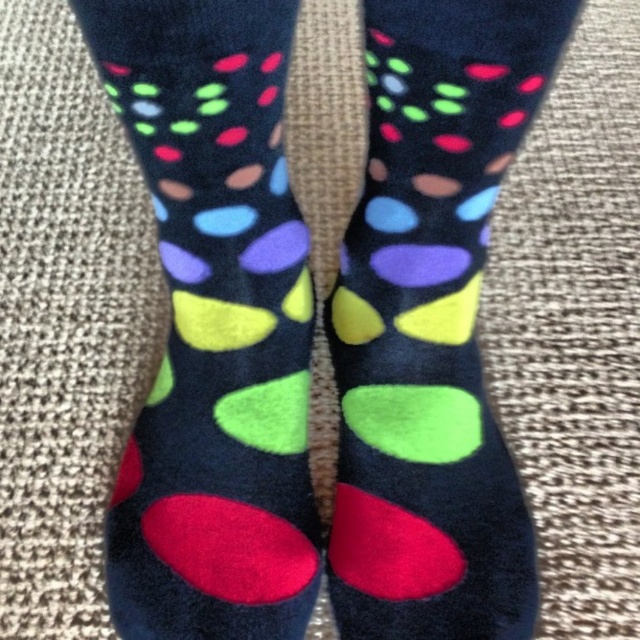
You are taking a photo of the colorful socks and the textured object in the scene. You want to focus on the point at coordinate point (172,8) and point (376,344). Which point should you adjust your camera focus to first to ensure both are in focus?

Since point (172,8) is closer to the camera than point (376,344), you should focus on point (172,8) first to ensure both points are in focus.

You are trying to decide which pair of socks to wear today. You notice that the fuzzy multicolored socks at center and the matte black socks at center are both available. Based on their height, which pair would you choose if you want the shorter ones?

The fuzzy multicolored socks at center has a lesser height compared to matte black socks at center, so you should choose the fuzzy multicolored socks at center if you want the shorter ones.